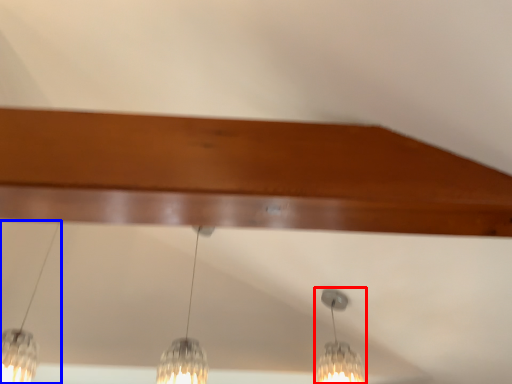
Question: Which object is closer to the camera taking this photo, lamp (highlighted by a red box) or lamp (highlighted by a blue box)?

Choices:
 (A) lamp
 (B) lamp

Answer: (B)